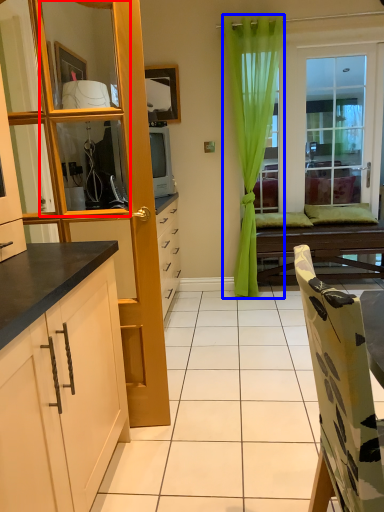
Question: Which object is further to the camera taking this photo, mirror (highlighted by a red box) or curtain (highlighted by a blue box)?

Choices:
 (A) mirror
 (B) curtain

Answer: (B)